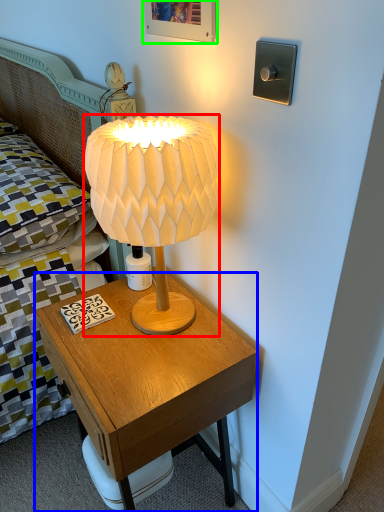
Question: Which is farther away from lamp (highlighted by a red box)? nightstand (highlighted by a blue box) or picture frame (highlighted by a green box)?

Choices:
 (A) nightstand
 (B) picture frame

Answer: (B)